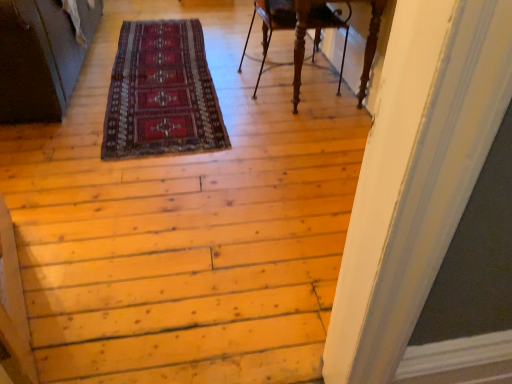
Question: Is wooden carved chair at upper center at the left side of red woolen rug at center?

Choices:
 (A) no
 (B) yes

Answer: (A)

Question: Does wooden carved chair at upper center have a smaller size compared to red woolen rug at center?

Choices:
 (A) yes
 (B) no

Answer: (B)

Question: Is wooden carved chair at upper center far away from red woolen rug at center?

Choices:
 (A) no
 (B) yes

Answer: (A)

Question: Can you confirm if wooden carved chair at upper center is thinner than red woolen rug at center?

Choices:
 (A) no
 (B) yes

Answer: (B)

Question: Is wooden carved chair at upper center taller than red woolen rug at center?

Choices:
 (A) yes
 (B) no

Answer: (A)

Question: Is wooden carved chair at upper center surrounding red woolen rug at center?

Choices:
 (A) no
 (B) yes

Answer: (A)

Question: From the image's perspective, would you say red woolen rug at center is positioned over wooden carved chair at upper center?

Choices:
 (A) yes
 (B) no

Answer: (B)

Question: Is red woolen rug at center further to the viewer compared to wooden carved chair at upper center?

Choices:
 (A) yes
 (B) no

Answer: (B)

Question: Can you confirm if red woolen rug at center is taller than wooden carved chair at upper center?

Choices:
 (A) no
 (B) yes

Answer: (A)

Question: Is wooden carved chair at upper center a part of red woolen rug at center?

Choices:
 (A) no
 (B) yes

Answer: (A)

Question: From the image's perspective, does red woolen rug at center appear lower than wooden carved chair at upper center?

Choices:
 (A) yes
 (B) no

Answer: (A)

Question: Is red woolen rug at center at the right side of wooden carved chair at upper center?

Choices:
 (A) yes
 (B) no

Answer: (B)

Question: Visually, is wooden carved chair at upper center positioned to the left or to the right of red woolen rug at center?

Choices:
 (A) right
 (B) left

Answer: (A)